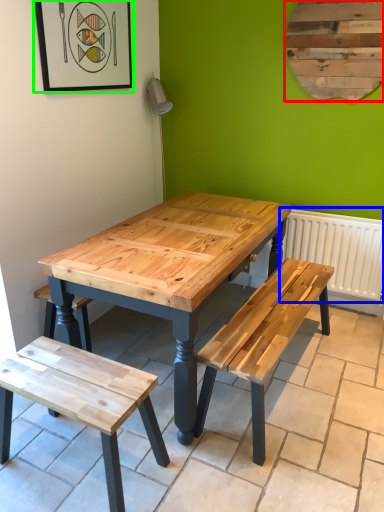
Question: Which is nearer to the bulletin board (highlighted by a red box)? radiator (highlighted by a blue box) or picture frame (highlighted by a green box).

Choices:
 (A) radiator
 (B) picture frame

Answer: (A)